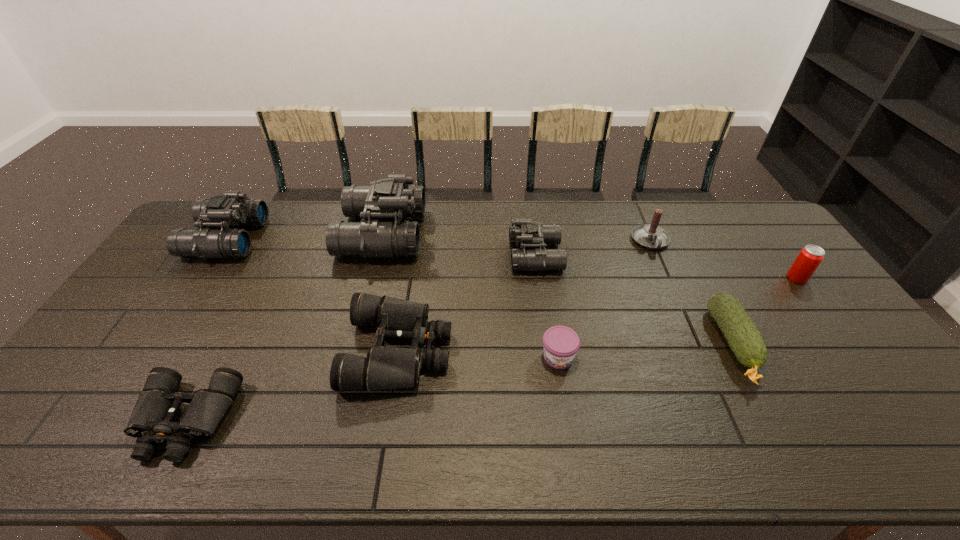
Find the location of a particular element. The image size is (960, 540). the right black binoculars is located at coordinates (384, 367).

Find the location of a particular element. Image resolution: width=960 pixels, height=540 pixels. green cucumber is located at coordinates (745, 341).

Where is `jam`? jam is located at coordinates (560, 343).

What are the coordinates of `the smaller black binoculars` in the screenshot? It's located at (151, 421).

Locate an element on the screen. the shortest binoculars is located at coordinates tap(151, 421).

At what (x,y) coordinates should I click in order to perform the action: click on vacant area located 0.270m through the lenses of the second blue binoculars from left to right. Please return your answer as a coordinate pair (x, y). The height and width of the screenshot is (540, 960). Looking at the image, I should click on (499, 234).

At what (x,y) coordinates should I click in order to perform the action: click on free space located 0.100m through the lenses of the second tallest binoculars. Please return your answer as a coordinate pair (x, y). Looking at the image, I should click on (288, 239).

You are a GUI agent. You are given a task and a screenshot of the screen. Output one action in this format:
    pyautogui.click(x=<x>, y=<y>)
    Task: Click on the blank space located on the side of the candle with the handle loop
    The image size is (960, 540).
    Given the screenshot: What is the action you would take?
    pyautogui.click(x=682, y=314)

The width and height of the screenshot is (960, 540). What are the coordinates of `free space located through the lenses of the rightmost blue binoculars` in the screenshot? It's located at (456, 255).

Identify the location of free space located through the lenses of the rightmost blue binoculars. This screenshot has height=540, width=960. (402, 255).